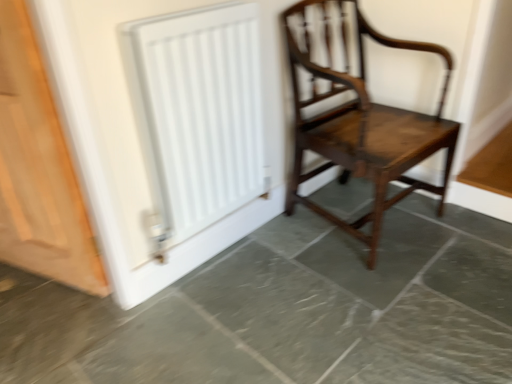
This screenshot has height=384, width=512. Identify the location of empty space that is ontop of white matte radiator at upper left (from a real-world perspective). (172, 8).